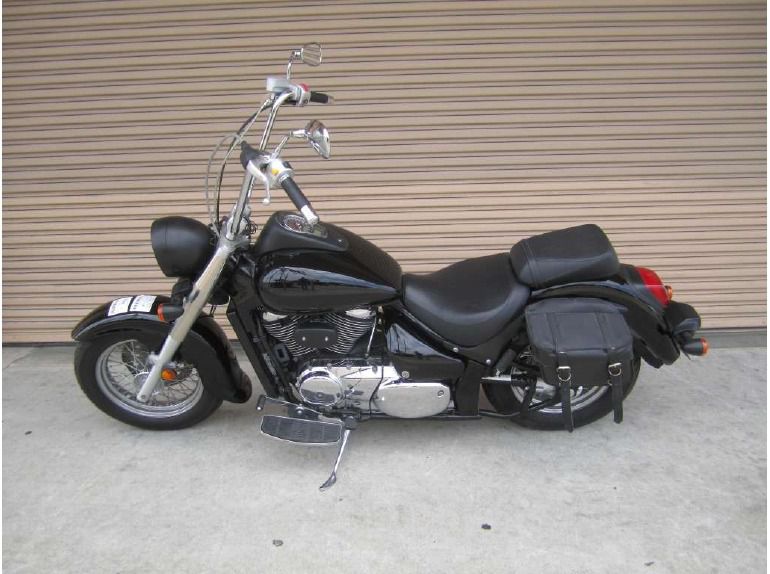
Find the location of `mirror`. mirror is located at coordinates (310, 48), (319, 135).